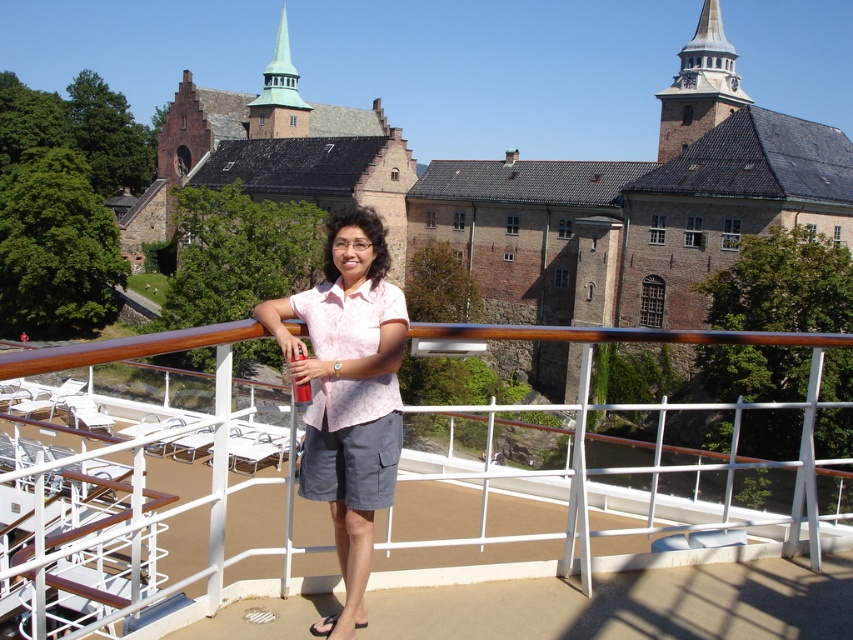
Who is taller, pink floral shirt at center or white metal railing at center?

Standing taller between the two is pink floral shirt at center.

This screenshot has width=853, height=640. I want to click on pink floral shirt at center, so click(347, 394).

This screenshot has height=640, width=853. I want to click on pink floral shirt at center, so click(347, 394).